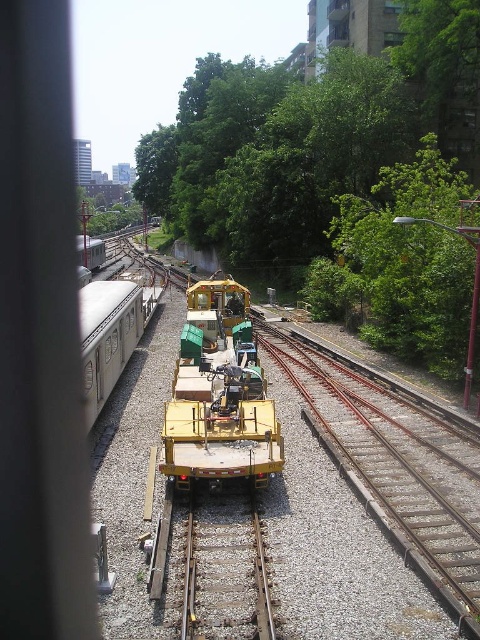
Question: Among these objects, which one is farthest from the camera?

Choices:
 (A) green leafy tree at right
 (B) smooth metal train track at center
 (C) yellow matte train car at center
 (D) brown metal train track at center

Answer: (A)

Question: Which point appears closest to the camera in this image?

Choices:
 (A) (448, 372)
 (B) (162, 458)

Answer: (B)

Question: In this image, where is green leafy tree at right located relative to smooth metal train track at center?

Choices:
 (A) right
 (B) left

Answer: (A)

Question: Is brown metal train track at center thinner than smooth metal train track at center?

Choices:
 (A) yes
 (B) no

Answer: (B)

Question: Among these points, which one is nearest to the camera?

Choices:
 (A) (249, 360)
 (B) (454, 515)

Answer: (B)

Question: Can you confirm if yellow matte train car at center is thinner than smooth metal train track at center?

Choices:
 (A) no
 (B) yes

Answer: (A)